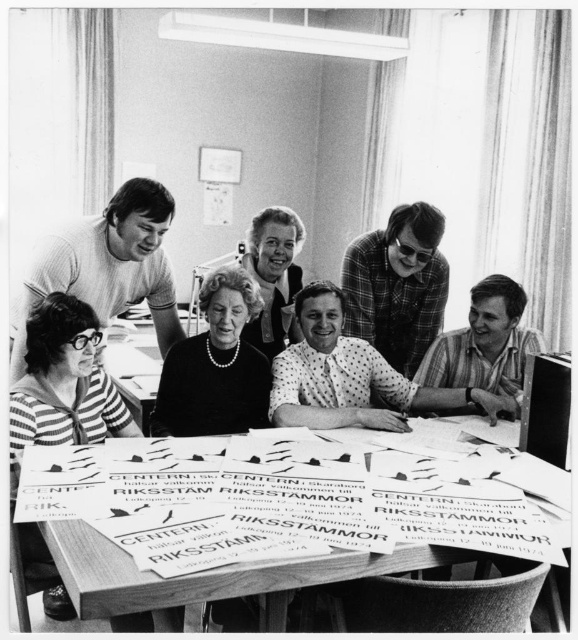
Is point (102, 502) in front of point (179, 396)?

Yes, it is in front of point (179, 396).

What do you see at coordinates (257, 518) in the screenshot? I see `wooden table at center` at bounding box center [257, 518].

Identify the location of wooden table at center. Image resolution: width=578 pixels, height=640 pixels. (257, 518).

At what (x,y) coordinates should I click in order to perform the action: click on wooden table at center. Please return your answer as a coordinate pair (x, y). The image size is (578, 640). Looking at the image, I should click on (257, 518).

Does striped fabric at lower left appear over matte black dress at center?

No, striped fabric at lower left is not above matte black dress at center.

Which is behind, point (31, 538) or point (286, 211)?

The point (286, 211) is more distant.

I want to click on striped fabric at lower left, so click(x=64, y=384).

Does black pearl necklace at center have a greater height compared to pearl necklace at center?

No.

Is black pearl necklace at center shorter than pearl necklace at center?

Yes, black pearl necklace at center is shorter than pearl necklace at center.

Describe the element at coordinates (350, 376) in the screenshot. I see `black pearl necklace at center` at that location.

Identify the location of black pearl necklace at center. This screenshot has height=640, width=578. (350, 376).